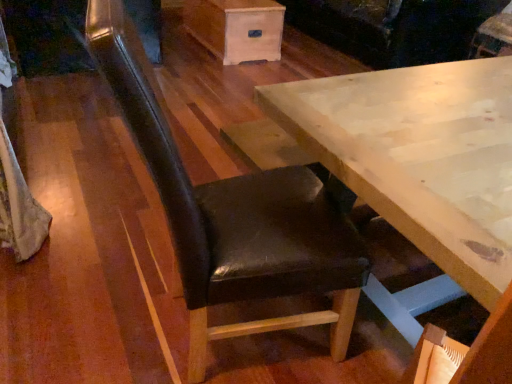
Question: From the image's perspective, is light wood table at center positioned above or below wooden drawer at upper center?

Choices:
 (A) below
 (B) above

Answer: (A)

Question: Would you say light wood table at center is inside or outside wooden drawer at upper center?

Choices:
 (A) inside
 (B) outside

Answer: (B)

Question: Which of these objects is positioned farthest from the velvet dark brown couch at upper center?

Choices:
 (A) wooden drawer at upper center
 (B) black leather chair at center
 (C) light wood table at center

Answer: (B)

Question: Which is farther from the velvet dark brown couch at upper center?

Choices:
 (A) black leather chair at center
 (B) light wood table at center
 (C) wooden drawer at upper center

Answer: (A)